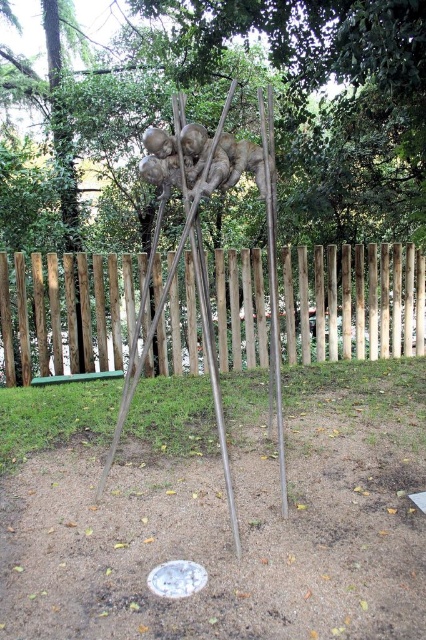
Based on the photo, which of these two, brushed metal tripod at center or wooden fence at center, stands taller?

wooden fence at center is taller.

From the picture: Is brushed metal tripod at center positioned before wooden fence at center?

Yes, it is in front of wooden fence at center.

This screenshot has width=426, height=640. What do you see at coordinates (216, 508) in the screenshot?
I see `brushed metal tripod at center` at bounding box center [216, 508].

This screenshot has height=640, width=426. Find the location of `brushed metal tripod at center`. brushed metal tripod at center is located at coordinates coord(216,508).

Who is higher up, brushed metal sculpture at center or wooden fence at center?

Positioned higher is brushed metal sculpture at center.

Is brushed metal sculpture at center closer to the viewer compared to wooden fence at center?

That is False.

Between point (158, 12) and point (391, 298), which one is positioned in front?

Point (158, 12) is more forward.

The width and height of the screenshot is (426, 640). I want to click on brushed metal sculpture at center, so click(325, 104).

Is brushed metal tripod at center smaller than metallic polished pole at center?

No, brushed metal tripod at center is not smaller than metallic polished pole at center.

Which is below, brushed metal tripod at center or metallic polished pole at center?

Positioned lower is brushed metal tripod at center.

Between point (114, 524) and point (270, 333), which one is positioned in front?

Positioned in front is point (114, 524).

Identify the location of brushed metal tripod at center. The height and width of the screenshot is (640, 426). (216, 508).